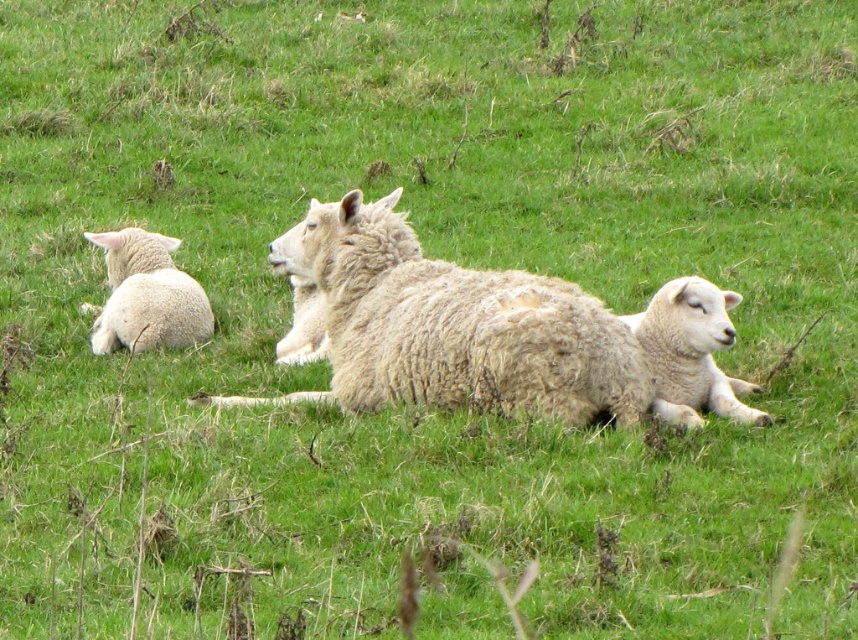
Question: Which object is positioned farthest from the fuzzy white sheep at center?

Choices:
 (A) white woolen lamb at left
 (B) white woolen lamb at center

Answer: (A)

Question: From the image, what is the correct spatial relationship of fuzzy white sheep at center in relation to white woolen lamb at center?

Choices:
 (A) right
 (B) left

Answer: (B)

Question: Which point is closer to the camera?

Choices:
 (A) (x=119, y=346)
 (B) (x=409, y=337)
 (C) (x=696, y=340)

Answer: (B)

Question: Considering the real-world distances, which object is closest to the white woolen lamb at left?

Choices:
 (A) fuzzy white sheep at center
 (B) white woolen lamb at center

Answer: (A)

Question: Is fuzzy white sheep at center to the left of white woolen lamb at center from the viewer's perspective?

Choices:
 (A) yes
 (B) no

Answer: (A)

Question: Does fuzzy white sheep at center appear under white woolen lamb at left?

Choices:
 (A) yes
 (B) no

Answer: (A)